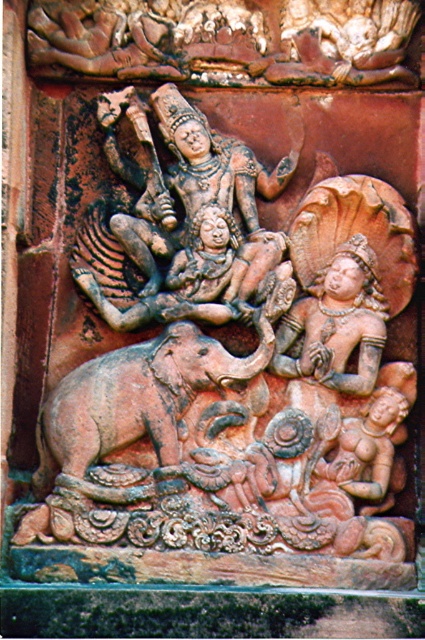
Question: Considering the relative positions of rustic stone statue at center and matte terracotta deity at center in the image provided, where is rustic stone statue at center located with respect to matte terracotta deity at center?

Choices:
 (A) left
 (B) right

Answer: (A)

Question: Which object is positioned closest to the matte terracotta deity at center?

Choices:
 (A) rustic stone statue at center
 (B) terracotta elephant at center
 (C) terracotta statue at center

Answer: (C)

Question: Which point is farther from the camera taking this photo?

Choices:
 (A) (320, 321)
 (B) (223, 536)
 (C) (232, 285)
 (D) (170, 349)

Answer: (C)

Question: Among these objects, which one is nearest to the camera?

Choices:
 (A) terracotta statue at center
 (B) terracotta elephant at center
 (C) rustic stone statue at center

Answer: (A)

Question: Does terracotta statue at center have a lesser width compared to terracotta elephant at center?

Choices:
 (A) no
 (B) yes

Answer: (A)

Question: Is rustic stone statue at center positioned at the back of matte terracotta deity at center?

Choices:
 (A) yes
 (B) no

Answer: (B)